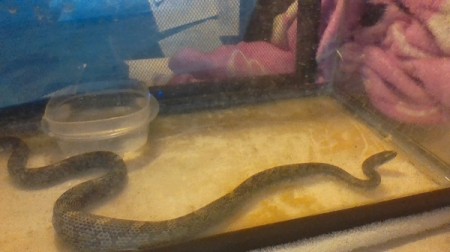
I want to click on plastic container, so click(114, 119).